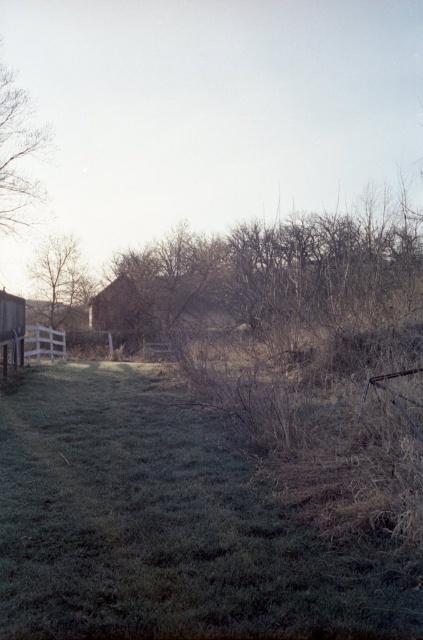
You are standing at the edge of the path in this frosty rural scene. You need to cross from the green grass at center to the smooth brown tree at left. Which direction should you move to reach the tree from the grass?

To reach the smooth brown tree at left from the green grass at center, you should move to the left since the tree is positioned to the left of the grass.

You are standing on the path in the rural scene. You see the green grass at center and the smooth brown tree at left. Which object is closer to your right side?

The green grass at center is closer to your right side because it is positioned to the right of the smooth brown tree at left.

You are standing on the path in the rural scene. You need to determine which object is taller between the green grass at center and the smooth brown tree at left. Which one is taller?

The smooth brown tree at left is taller than the green grass at center.